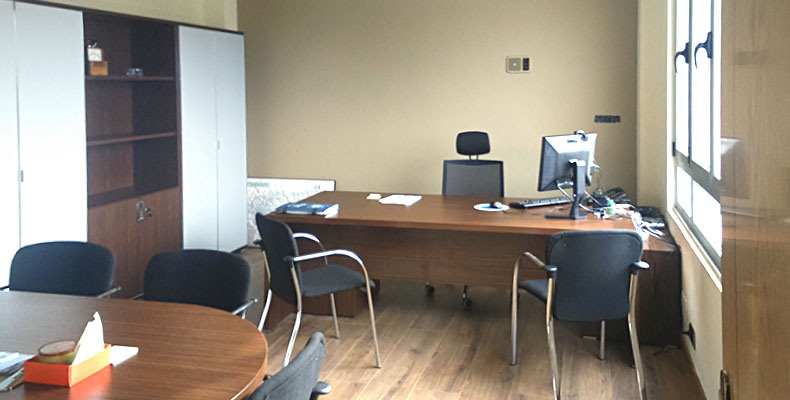
The height and width of the screenshot is (400, 790). Find the location of `window latches`. window latches is located at coordinates (708, 45), (683, 51).